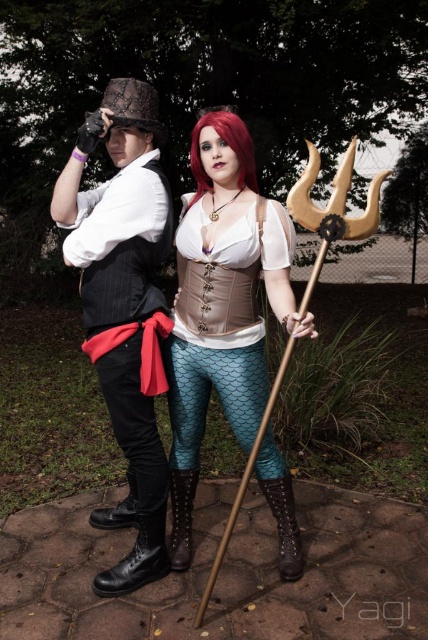
You are a photographer trying to capture a clear shot of both the teal fishscale leggings at center and the brown leather boot at lower center. Since you can only focus on one object at a time, which one should you choose to ensure the other is still somewhat in focus?

The teal fishscale leggings at center is closer to the viewer than the brown leather boot at lower center. To ensure both are somewhat in focus, you should focus on the teal fishscale leggings at center since it is closer, as depth of field typically extends further behind the focal point than in front.

You are standing at the camera position and want to take a photo of the two people in the scene. The focus point of your camera is set to point (214, 150). Will this focus point be closer to the steampunk character or the mermaid?

The focus point at point (214, 150) is 2.46 meters from the camera, so it will be closer to the steampunk character since they are positioned on the left side of the image.

You are a photographer setting up a camera to capture the scene. You need to ensure both the teal fishscale leggings at center and the brown leather boot at lower center are in focus. Which object should you adjust the camera focus to prioritize first if one is wider than the other?

The teal fishscale leggings at center might be wider than the brown leather boot at lower center, so you should prioritize focusing on the teal fishscale leggings at center first to ensure proper focus coverage.